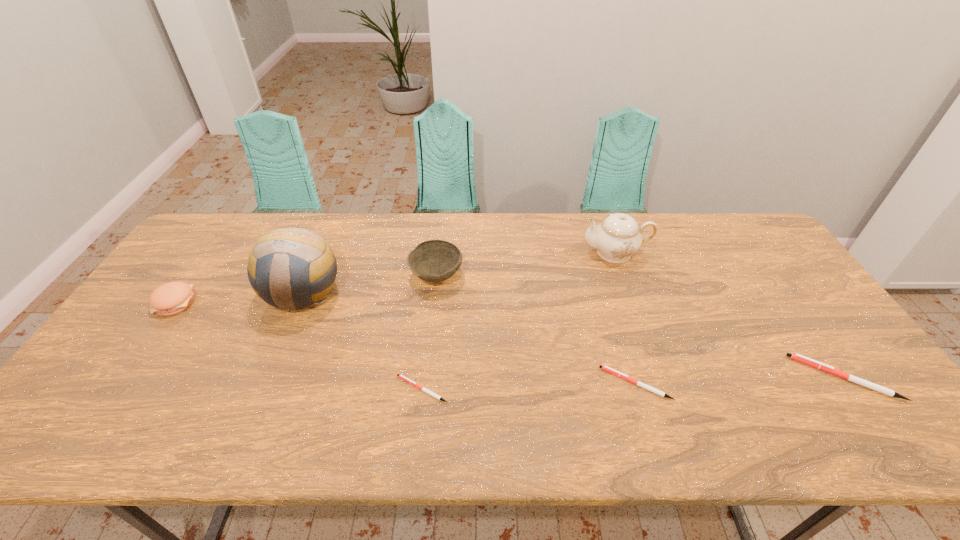
Where is `blank area located on the clicker of the third shortest object`? Image resolution: width=960 pixels, height=540 pixels. blank area located on the clicker of the third shortest object is located at coordinates (668, 377).

The width and height of the screenshot is (960, 540). Identify the location of free space located 0.290m at the spout of the chinaware. (492, 253).

You are a GUI agent. You are given a task and a screenshot of the screen. Output one action in this format:
    pyautogui.click(x=<x>, y=<y>)
    Task: Click on the vacant space situated 0.120m at the spout of the chinaware
    This screenshot has height=540, width=960.
    Given the screenshot: What is the action you would take?
    pyautogui.click(x=544, y=253)

Locate an element on the screen. The image size is (960, 540). free space located at the spout of the chinaware is located at coordinates (501, 253).

Locate an element on the screen. The image size is (960, 540). vacant space located 0.060m on the left of the sixth object from right to left is located at coordinates (244, 293).

At what (x,y) coordinates should I click in order to perform the action: click on vacant space positioned 0.190m on the left of the bowl. Please return your answer as a coordinate pair (x, y). Looking at the image, I should click on (347, 276).

Locate an element on the screen. free region located on the back of the fourth shortest object is located at coordinates (212, 250).

Identify the location of object positioned at the far edge. The height and width of the screenshot is (540, 960). (618, 236).

Locate an element on the screen. This screenshot has width=960, height=540. object at the left edge is located at coordinates [171, 298].

Locate an element on the screen. object located in the right edge section of the desktop is located at coordinates (797, 357).